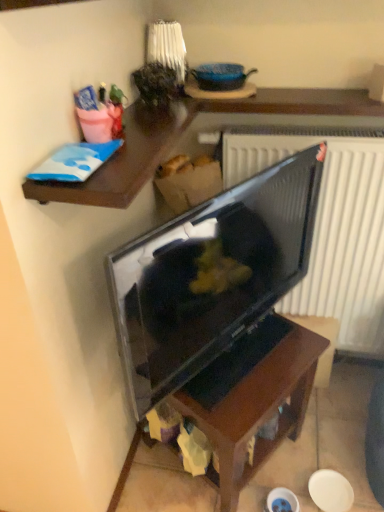
Question: From the image's perspective, is dark wood table at center located above or below matte black tv at center?

Choices:
 (A) above
 (B) below

Answer: (B)

Question: Is dark wood table at center inside the boundaries of matte black tv at center, or outside?

Choices:
 (A) outside
 (B) inside

Answer: (A)

Question: Which object is positioned closest to the dark wood table at center?

Choices:
 (A) matte black tv at center
 (B) wooden shelf at upper left

Answer: (A)

Question: Estimate the real-world distances between objects in this image. Which object is closer to the dark wood table at center?

Choices:
 (A) wooden shelf at upper left
 (B) matte black tv at center

Answer: (B)